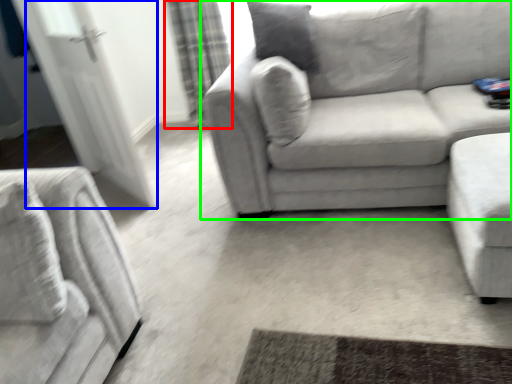
Question: Which is nearer to the curtain (highlighted by a red box)? glass door (highlighted by a blue box) or studio couch (highlighted by a green box).

Choices:
 (A) glass door
 (B) studio couch

Answer: (A)